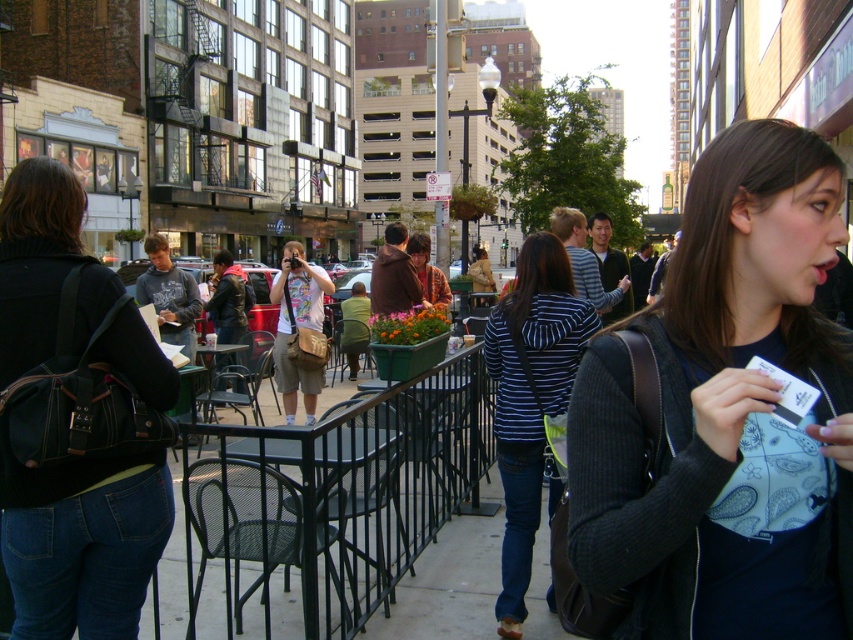
Question: Can you confirm if light blue cotton shirt at center is thinner than leather jacket at center?

Choices:
 (A) yes
 (B) no

Answer: (A)

Question: Which of the following is the farthest from the observer?

Choices:
 (A) (241, 268)
 (B) (704, 602)
 (C) (62, 600)

Answer: (A)

Question: Which of the following is the closest to the observer?

Choices:
 (A) dark gray sweater at center
 (B) leather jacket at center
 (C) light blue cotton shirt at center

Answer: (A)

Question: Does striped fabric jacket at center have a lesser width compared to light blue cotton shirt at center?

Choices:
 (A) yes
 (B) no

Answer: (A)

Question: Is denim jeans at lower left below striped fabric jacket at center?

Choices:
 (A) no
 (B) yes

Answer: (A)

Question: Which point appears farthest from the camera in this image?

Choices:
 (A) (538, 436)
 (B) (672, 376)
 (C) (140, 339)
 (D) (274, 291)

Answer: (D)